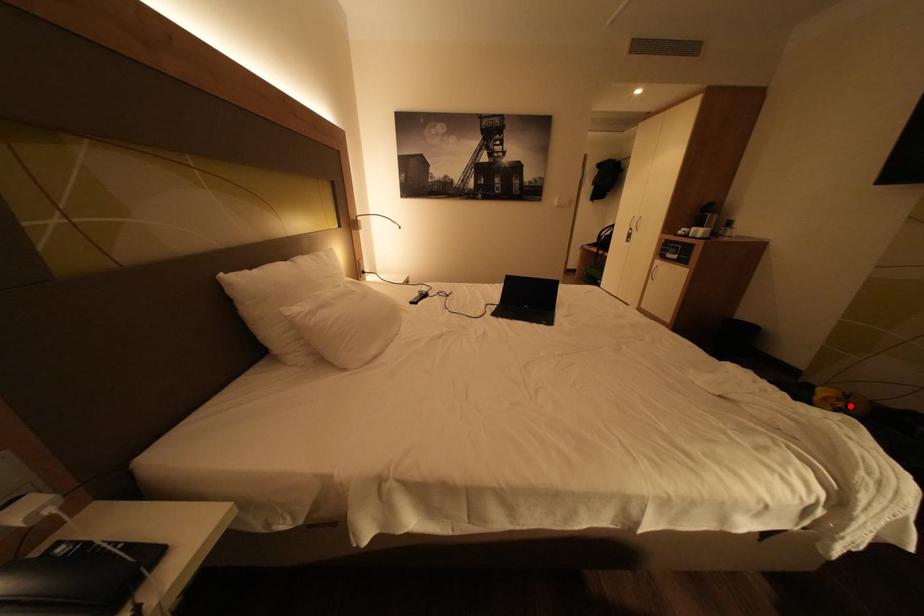
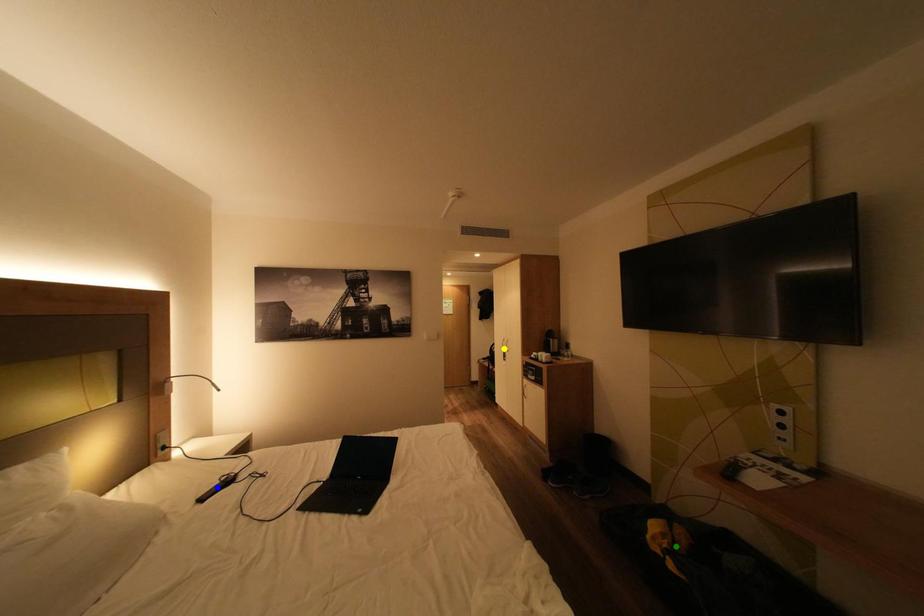
Question: I am providing you with two images of the same scene from different viewpoints. A red point is marked on the first image. You are given multiple points on the second image. Can you choose the point in image 2 that corresponds to the point in image 1?

Choices:
 (A) green point
 (B) blue point
 (C) yellow point

Answer: (A)